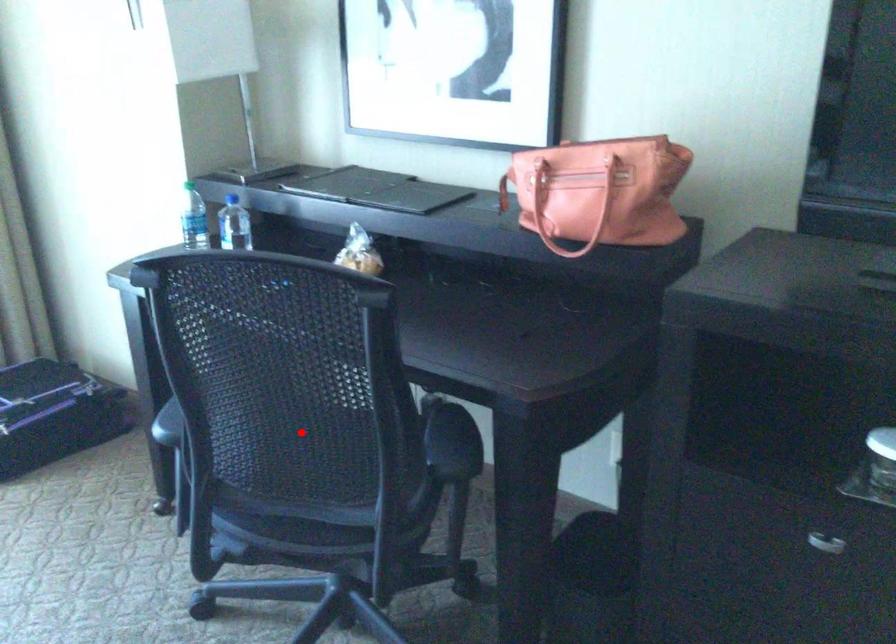
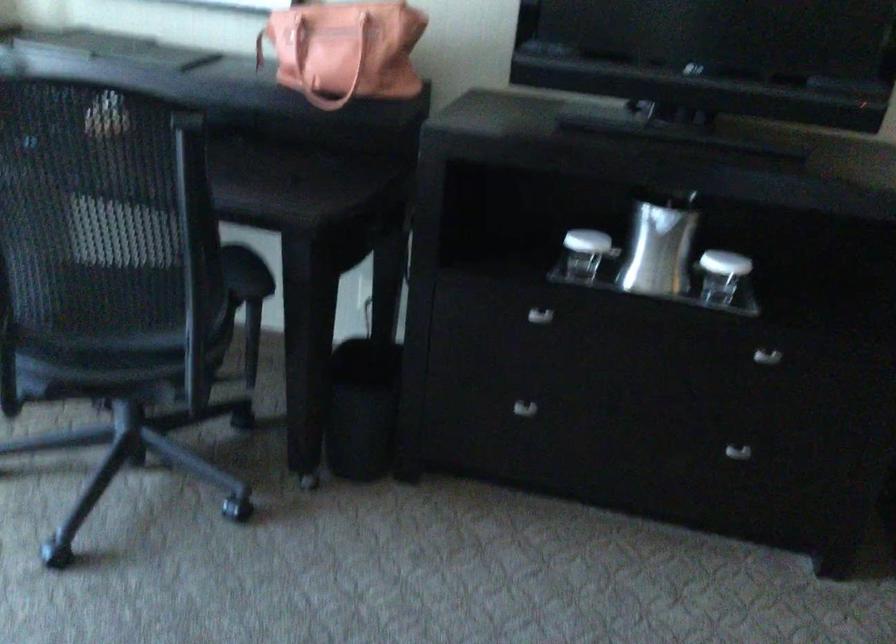
In the second image, find the point that corresponds to the highlighted location in the first image.

(107, 265)